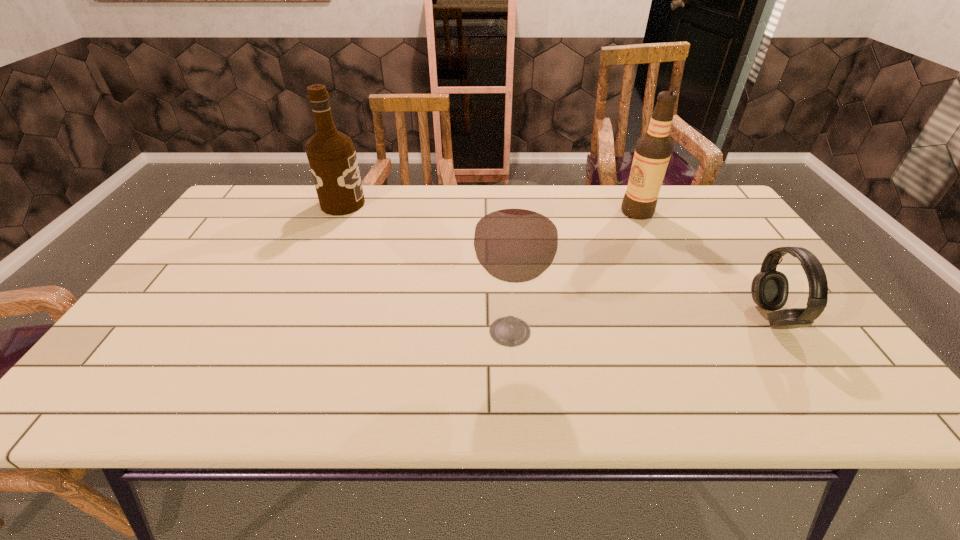
Where is `the leftmost object`? This screenshot has height=540, width=960. the leftmost object is located at coordinates (332, 158).

Identify the location of the third object from left to right. (653, 150).

Where is `the second object from left to right`? The height and width of the screenshot is (540, 960). the second object from left to right is located at coordinates (516, 239).

Where is `the second alcohol from right to left`? the second alcohol from right to left is located at coordinates (516, 239).

Identify the location of headset. The image size is (960, 540). (770, 288).

Where is `the shortest object`? The height and width of the screenshot is (540, 960). the shortest object is located at coordinates (770, 288).

At what (x,y) coordinates should I click in order to perform the action: click on free spot located 0.340m on the label of the leftmost alcohol. Please return your answer as a coordinate pair (x, y). This screenshot has height=540, width=960. Looking at the image, I should click on (470, 204).

At what (x,y) coordinates should I click in order to perform the action: click on free space located on the label of the rightmost alcohol. Please return your answer as a coordinate pair (x, y). This screenshot has height=540, width=960. Looking at the image, I should click on (503, 212).

Where is `free space located 0.260m on the label of the rightmost alcohol`? This screenshot has width=960, height=540. free space located 0.260m on the label of the rightmost alcohol is located at coordinates (538, 212).

Identify the location of free location located on the label of the rightmost alcohol. (564, 212).